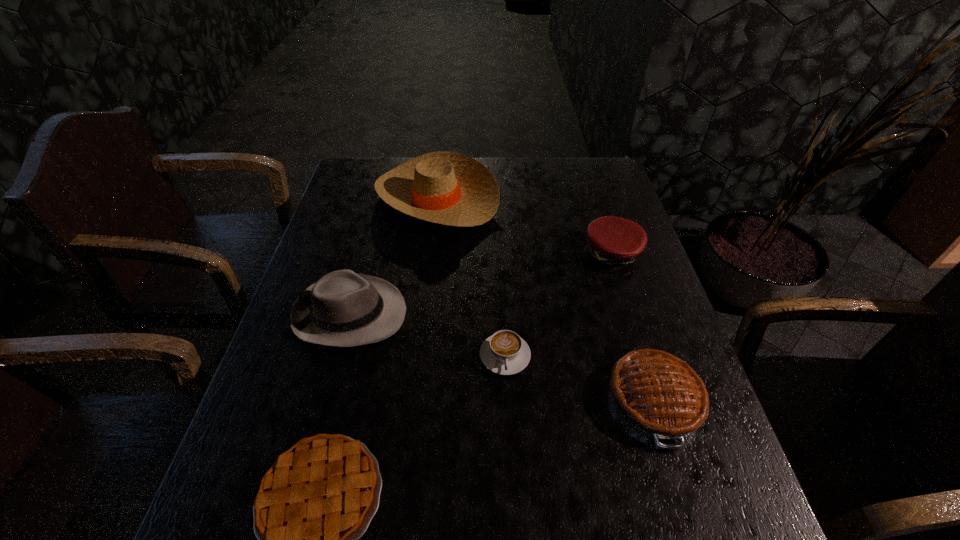
Identify the location of vacant point located between the fedora and the cap. This screenshot has width=960, height=540. (x=480, y=284).

At what (x,y) coordinates should I click in order to perform the action: click on vacant space in between the right pie and the cap. Please return your answer as a coordinate pair (x, y). This screenshot has height=540, width=960. Looking at the image, I should click on (632, 327).

Image resolution: width=960 pixels, height=540 pixels. Find the location of `free space between the sunhat and the cap`. free space between the sunhat and the cap is located at coordinates (524, 225).

What are the coordinates of `vacant space that is in between the second shortest object and the right pie` in the screenshot? It's located at (579, 378).

You are a GUI agent. You are given a task and a screenshot of the screen. Output one action in this format:
    pyautogui.click(x=<x>, y=<y>)
    Task: Click on the vacant area that lies between the fifth tallest object and the sunhat
    
    Given the screenshot: What is the action you would take?
    pyautogui.click(x=471, y=276)

Identify the location of object that stands as the second closest to the cap. The image size is (960, 540). (656, 393).

Point out which object is positioned as the second nearest to the fifth tallest object. Please provide its 2D coordinates. Your answer should be formatted as a tuple, i.e. [(x, y)], where the tuple contains the x and y coordinates of a point satisfying the conditions above.

[(342, 309)]

Where is `vacant space that satisfies the following two spatial constraints: 1. on the side of the second shortest object with the handle; 2. on the right side of the right pie`? Image resolution: width=960 pixels, height=540 pixels. vacant space that satisfies the following two spatial constraints: 1. on the side of the second shortest object with the handle; 2. on the right side of the right pie is located at coordinates (507, 400).

Image resolution: width=960 pixels, height=540 pixels. Find the location of `free spot that satisfies the following two spatial constraints: 1. at the front of the cap where the visor is located; 2. on the front-facing side of the fedora`. free spot that satisfies the following two spatial constraints: 1. at the front of the cap where the visor is located; 2. on the front-facing side of the fedora is located at coordinates (630, 314).

Locate an element on the screen. This screenshot has height=540, width=960. free region that satisfies the following two spatial constraints: 1. on the front-facing side of the fedora; 2. on the back side of the right pie is located at coordinates (326, 400).